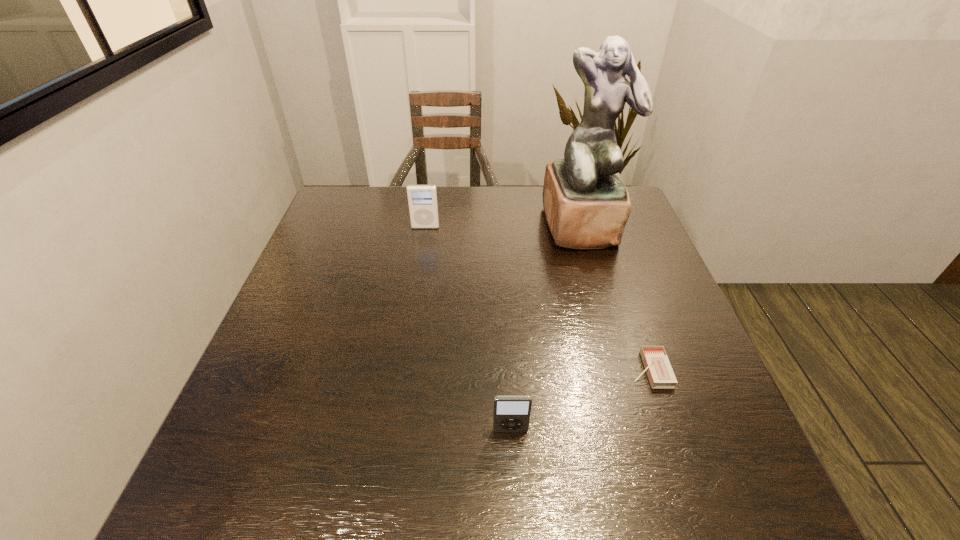
Image resolution: width=960 pixels, height=540 pixels. Find the location of `free space located 0.090m on the striking surface of the third farthest object`. free space located 0.090m on the striking surface of the third farthest object is located at coordinates (588, 369).

Identify the location of free space located 0.230m on the striking surface of the third farthest object. This screenshot has width=960, height=540. (520, 369).

Locate an element on the screen. The image size is (960, 540). free space located on the striking surface of the third farthest object is located at coordinates (449, 369).

You are a GUI agent. You are given a task and a screenshot of the screen. Output one action in this format:
    pyautogui.click(x=<x>, y=<y>)
    Task: Click on the sculpture located at the far edge
    
    Given the screenshot: What is the action you would take?
    pyautogui.click(x=586, y=204)

Locate an element on the screen. This screenshot has width=960, height=540. iPod situated at the far edge is located at coordinates (422, 199).

Find the location of a particular element. This screenshot has height=540, width=960. sculpture positioned at the right edge is located at coordinates (586, 204).

This screenshot has width=960, height=540. In order to click on matchbox present at the right edge in this screenshot , I will do [x=660, y=373].

Identify the location of object situated at the far right corner. The width and height of the screenshot is (960, 540). (586, 204).

What are the coordinates of `free space at the far edge of the desktop` in the screenshot? It's located at (458, 194).

In the image, there is a desktop. Where is `vacant space at the near edge`? The image size is (960, 540). vacant space at the near edge is located at coordinates (352, 483).